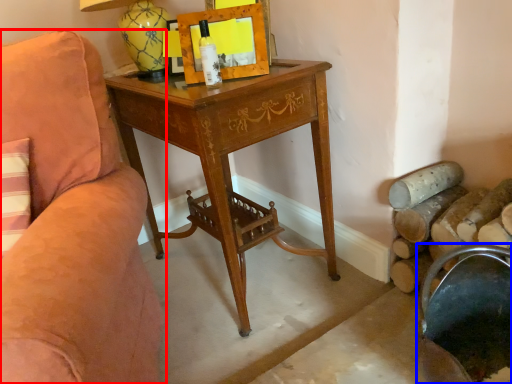
Question: Which object is further to the camera taking this photo, chair (highlighted by a red box) or rocking chair (highlighted by a blue box)?

Choices:
 (A) chair
 (B) rocking chair

Answer: (B)